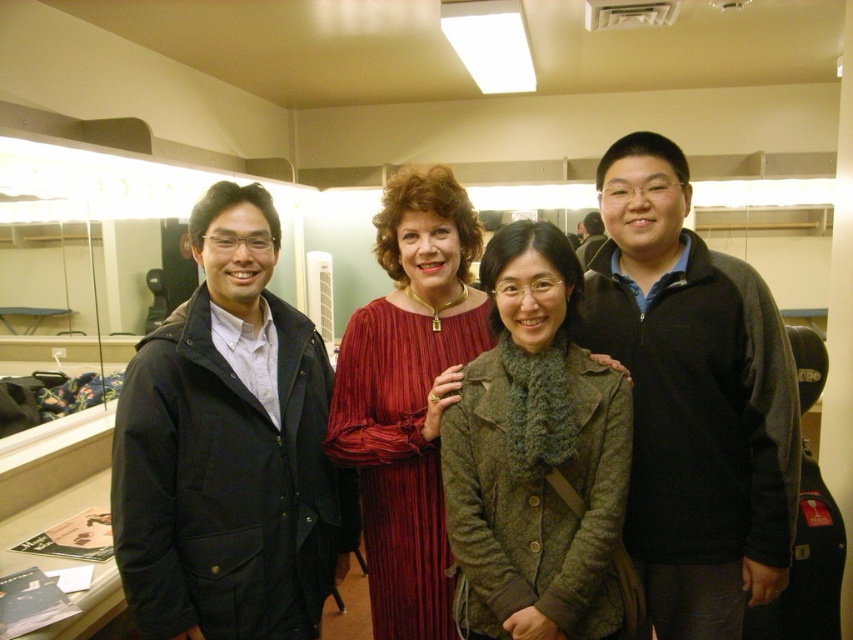
Between green woolen coat at center and matte red dress at center, which one has more height?

matte red dress at center is taller.

Between green woolen coat at center and matte red dress at center, which one has less height?

With less height is green woolen coat at center.

Locate an element on the screen. green woolen coat at center is located at coordinates (535, 458).

Is point (180, 634) positioned in front of point (556, 596)?

That is False.

Does matte black jacket at left appear on the right side of green woolen coat at center?

No, matte black jacket at left is not to the right of green woolen coat at center.

Describe the element at coordinates (229, 449) in the screenshot. This screenshot has width=853, height=640. I see `matte black jacket at left` at that location.

You are a GUI agent. You are given a task and a screenshot of the screen. Output one action in this format:
    pyautogui.click(x=<x>, y=<y>)
    Task: Click on the matte black jacket at left
    
    Given the screenshot: What is the action you would take?
    pyautogui.click(x=229, y=449)

Is black fleece jacket at right positioned behind green woolen coat at center?

That is True.

Measure the distance between point (798,413) and camera.

Point (798,413) and camera are 5.16 feet apart.

I want to click on black fleece jacket at right, so click(x=693, y=397).